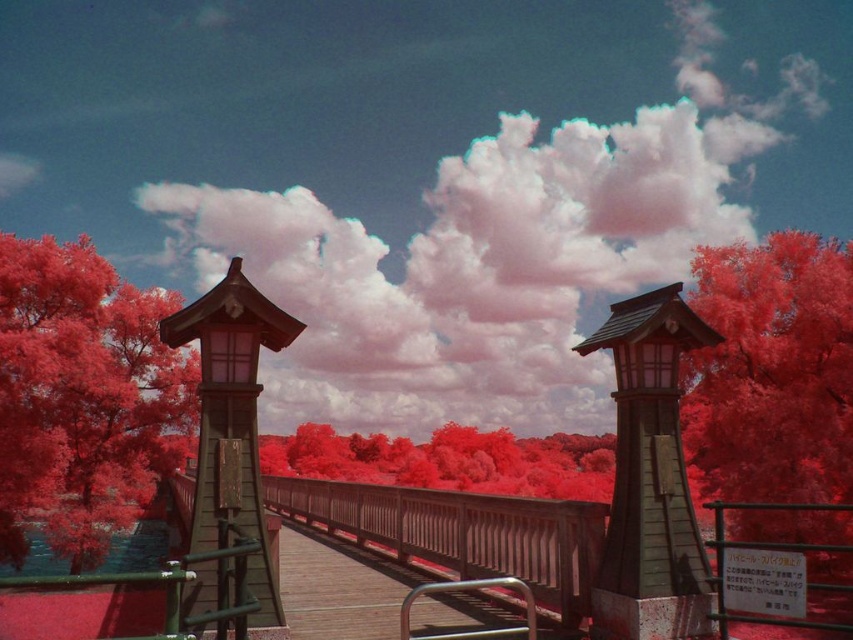
Question: In this image, where is wooden bell tower at center located relative to wooden gazebo at center?

Choices:
 (A) right
 (B) left

Answer: (A)

Question: Is smooth red tree at left smaller than wooden gazebo at center?

Choices:
 (A) no
 (B) yes

Answer: (A)

Question: Which point is closer to the camera taking this photo?

Choices:
 (A) (643, 394)
 (B) (556, 525)
 (C) (231, 461)
 (D) (39, 400)

Answer: (C)

Question: Which point is farther from the camera taking this photo?

Choices:
 (A) (321, 500)
 (B) (236, 352)
 (C) (619, 422)
 (D) (335, 419)

Answer: (D)

Question: Can you confirm if cloudy sky at upper center is wider than smooth red tree at left?

Choices:
 (A) yes
 (B) no

Answer: (A)

Question: Estimate the real-world distances between objects in this image. Which object is farther from the smooth red tree at left?

Choices:
 (A) wooden bridge at center
 (B) smooth red tree at center

Answer: (B)